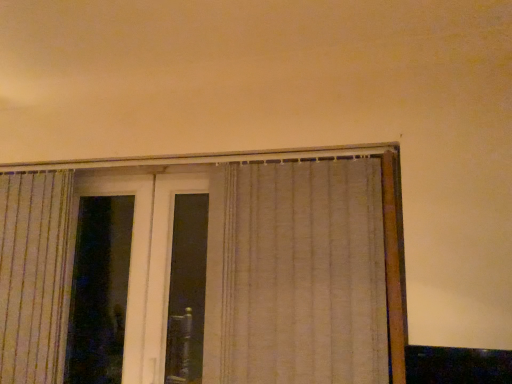
Question: Is transparent glass screen door at left smaller than beige textured curtain at center?

Choices:
 (A) no
 (B) yes

Answer: (B)

Question: Is transparent glass screen door at left located outside beige textured curtain at center?

Choices:
 (A) no
 (B) yes

Answer: (B)

Question: Does transparent glass screen door at left lie behind beige textured curtain at center?

Choices:
 (A) no
 (B) yes

Answer: (B)

Question: Would you say transparent glass screen door at left is a long distance from beige textured curtain at center?

Choices:
 (A) yes
 (B) no

Answer: (B)

Question: Is transparent glass screen door at left positioned with its back to beige textured curtain at center?

Choices:
 (A) no
 (B) yes

Answer: (A)

Question: Is the surface of transparent glass screen door at left in direct contact with beige textured curtain at center?

Choices:
 (A) yes
 (B) no

Answer: (B)

Question: Considering the relative positions of beige textured curtain at center and transparent glass screen door at left in the image provided, is beige textured curtain at center in front of transparent glass screen door at left?

Choices:
 (A) no
 (B) yes

Answer: (B)

Question: Does beige textured curtain at center have a greater width compared to transparent glass screen door at left?

Choices:
 (A) yes
 (B) no

Answer: (A)

Question: Is transparent glass screen door at left at the back of beige textured curtain at center?

Choices:
 (A) yes
 (B) no

Answer: (B)

Question: From the image's perspective, is beige textured curtain at center under transparent glass screen door at left?

Choices:
 (A) yes
 (B) no

Answer: (B)

Question: Is beige textured curtain at center with transparent glass screen door at left?

Choices:
 (A) no
 (B) yes

Answer: (A)

Question: From a real-world perspective, is beige textured curtain at center physically below transparent glass screen door at left?

Choices:
 (A) no
 (B) yes

Answer: (A)

Question: Considering the positions of beige textured curtain at center and transparent glass screen door at left in the image, is beige textured curtain at center wider or thinner than transparent glass screen door at left?

Choices:
 (A) wide
 (B) thin

Answer: (A)